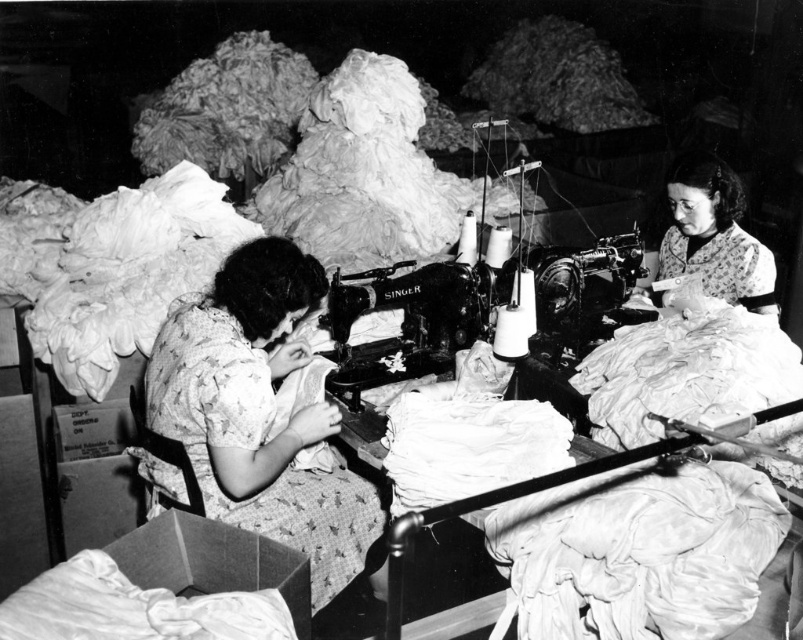
Is floral fabric dress at center wider than floral fabric dress at upper right?

Yes.

Is floral fabric dress at center in front of floral fabric dress at upper right?

Yes, floral fabric dress at center is closer to the viewer.

You are a GUI agent. You are given a task and a screenshot of the screen. Output one action in this format:
    pyautogui.click(x=<x>, y=<y>)
    Task: Click on the floral fabric dress at center
    The height and width of the screenshot is (640, 803).
    Given the screenshot: What is the action you would take?
    (x=259, y=413)